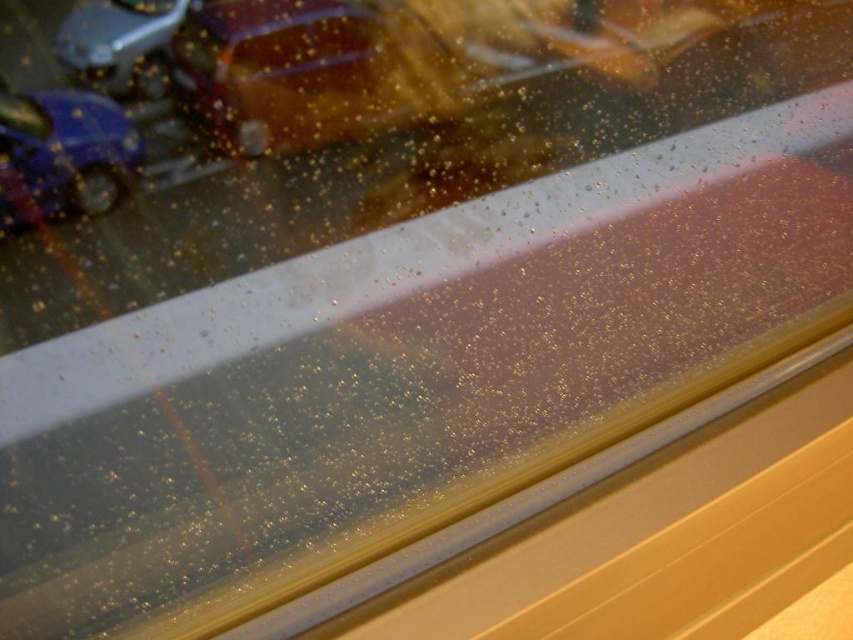
You are standing in front of the window and want to locate the shiny blue car at left. Where exactly is it positioned on the window?

The shiny blue car at left is positioned at point coordinates of 0.244 on the x axis and 0.074 on the y axis.

You are standing 30 inches away from the window. A point is marked at coordinates point (x=88, y=104). Is the point closer to you than the window?

The distance of point (x=88, y=104) from viewer is 33.46 inches, so the point is farther away from you than the window since you are standing 30 inches away from the window.

You are standing in front of the window and notice two points of condensation on the glass. The first point is at coordinates point [132,138] and the second is at point [114,88]. Which point is closer to you?

Point [114,88] is closer to you because it is in front of point [132,138].